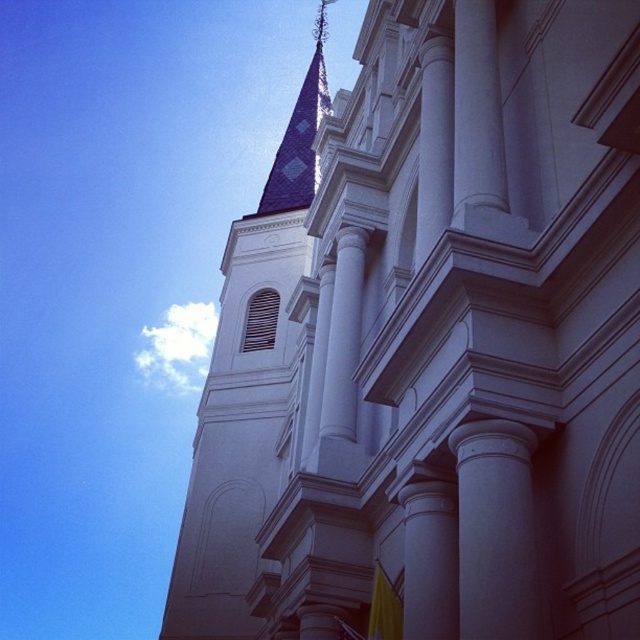
Question: Does white stone steeple at upper center appear under smooth white column at center?

Choices:
 (A) yes
 (B) no

Answer: (B)

Question: Does white stone steeple at upper center appear on the left side of smooth white column at center?

Choices:
 (A) no
 (B) yes

Answer: (B)

Question: Considering the relative positions of white stone steeple at upper center and smooth white column at center in the image provided, where is white stone steeple at upper center located with respect to smooth white column at center?

Choices:
 (A) above
 (B) below

Answer: (A)

Question: Which object is closer to the camera taking this photo?

Choices:
 (A) white stone steeple at upper center
 (B) smooth white column at center

Answer: (B)